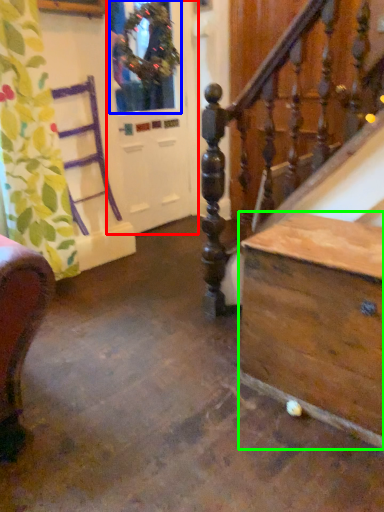
Question: Based on their relative distances, which object is farther from screen door (highlighted by a red box)? Choose from window (highlighted by a blue box) and table (highlighted by a green box).

Choices:
 (A) window
 (B) table

Answer: (B)